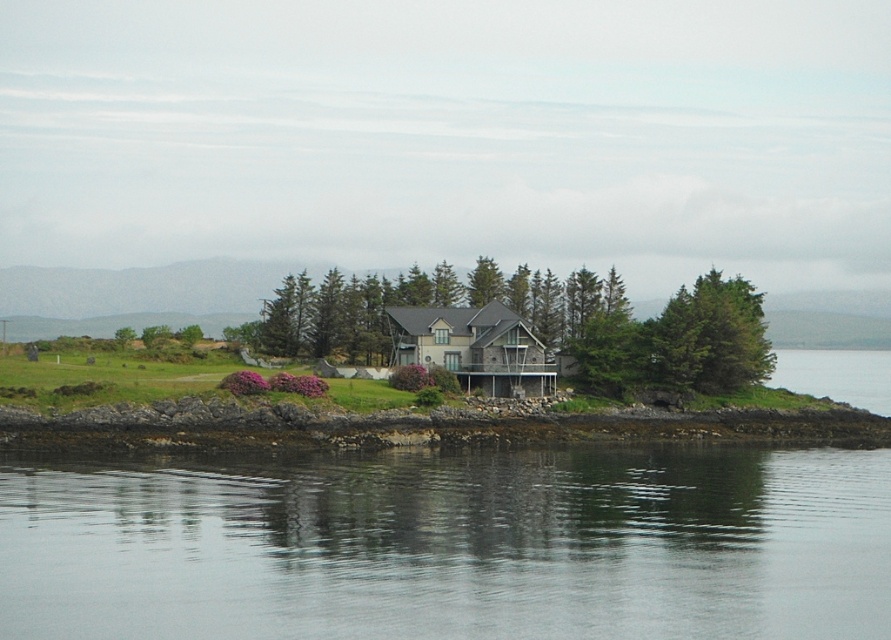
Question: Does rugged stone shoreline at lower left appear on the right side of green textured tree at upper right?

Choices:
 (A) no
 (B) yes

Answer: (A)

Question: Among these points, which one is farthest from the camera?

Choices:
 (A) (710, 314)
 (B) (759, 493)
 (C) (685, 330)
 (D) (88, 410)

Answer: (A)

Question: Which object is the closest to the rugged stone shoreline at lower left?

Choices:
 (A) green textured tree at upper right
 (B) transparent water at lower center
 (C) green textured house at center

Answer: (A)

Question: Is transparent water at lower center bigger than green textured house at center?

Choices:
 (A) yes
 (B) no

Answer: (B)

Question: From the image, what is the correct spatial relationship of transparent water at lower center in relation to green textured house at center?

Choices:
 (A) right
 (B) left

Answer: (B)

Question: Which object is positioned farthest from the green textured tree at upper right?

Choices:
 (A) transparent water at lower center
 (B) rugged stone shoreline at lower left

Answer: (A)